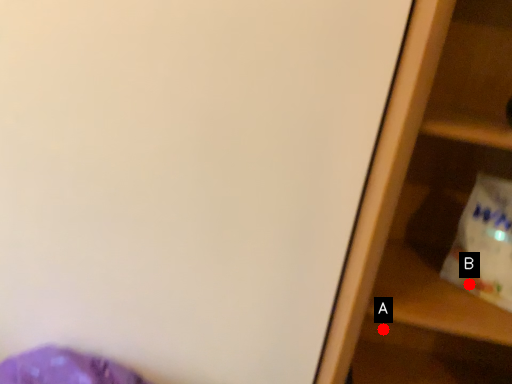
Question: Two points are circled on the image, labeled by A and B beside each circle. Among these points, which one is nearest to the camera?

Choices:
 (A) A is closer
 (B) B is closer

Answer: (B)